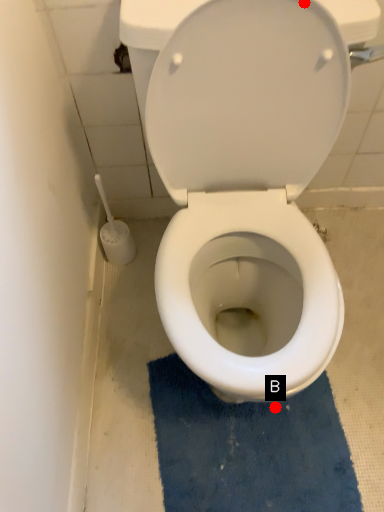
Question: Two points are circled on the image, labeled by A and B beside each circle. Which point is closer to the camera taking this photo?

Choices:
 (A) A is closer
 (B) B is closer

Answer: (A)